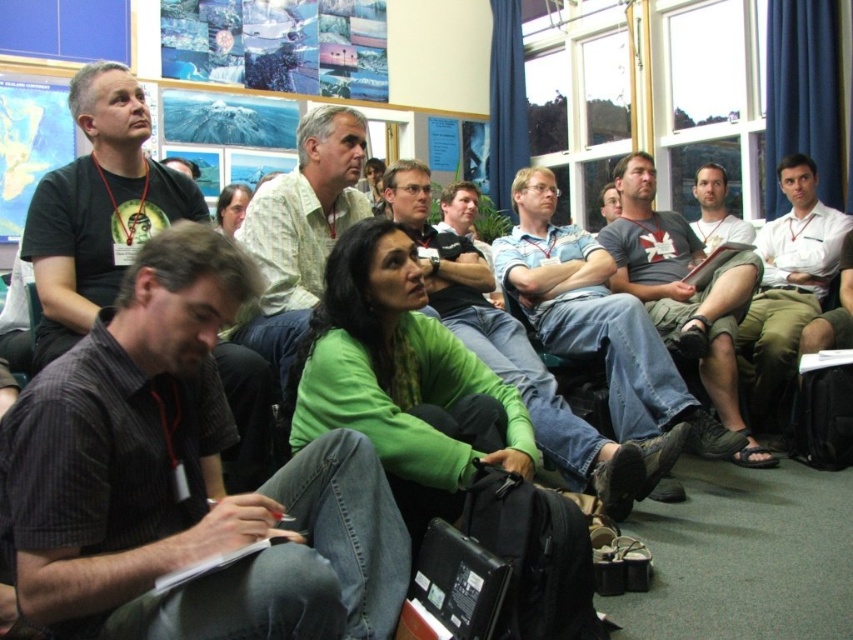
You are standing at the entrance of the conference room and want to locate the person wearing the dark gray striped shirt at lower left. According to the coordinates provided, where should you look to find them?

The dark gray striped shirt at lower left is located at coordinates point (186,481).

You are a photographer taking a picture of the group. You want to ensure that both the dark gray striped shirt at lower left and the white shirt at center are visible in the frame. Based on their positions, which shirt should you focus on first to include both in the shot?

The dark gray striped shirt at lower left is positioned on the left side of white shirt at center. To include both in the shot, focus on the white shirt at center first as it is centrally located, ensuring the dark gray striped shirt at lower left will also be captured to its left.

Looking at this image, you are standing at the entrance of the conference room and see the dark gray striped shirt at lower left and the green matte sweater at center. Which person is sitting closer to the front of the room?

The dark gray striped shirt at lower left is closer to the viewer than the green matte sweater at center, so the person wearing the dark gray striped shirt at lower left is sitting closer to the front of the room.